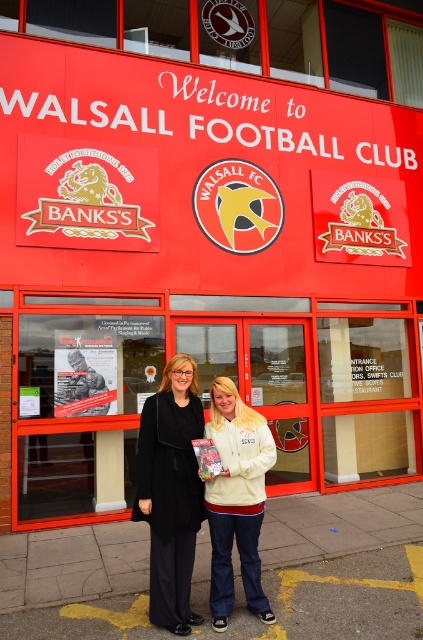
You are standing in front of the Walsall Football Club building and notice a black fabric coat at center and a red matte building at center. Which object is positioned to the right of the other?

The red matte building at center is to the right of the black fabric coat at center according to the description.

You are standing in front of the Walsall Football Club entrance. You see the red matte building at center and the white fleece jacket at center. Which object is closer to you?

The red matte building at center is closer to you than the white fleece jacket at center.